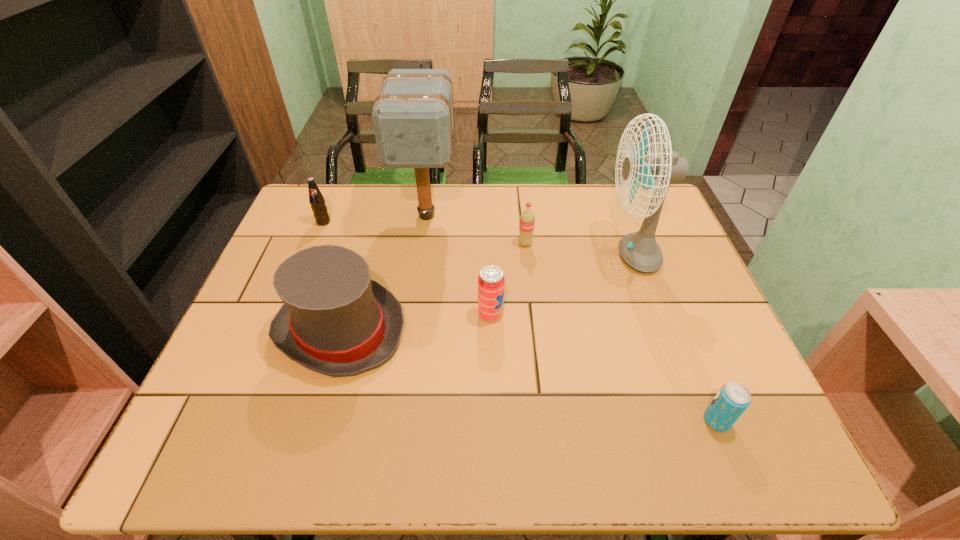
I want to click on mallet, so click(x=413, y=117).

What are the coordinates of `fan` in the screenshot? It's located at coord(639,250).

Identify the location of the fifth shortest object. (335, 320).

Locate an element on the screen. This screenshot has height=540, width=960. the leftmost soda can is located at coordinates (316, 199).

Identify the location of the third object from right to left. The image size is (960, 540). (527, 218).

What are the coordinates of `the second soda can from right to left` in the screenshot? It's located at (527, 218).

Locate an element on the screen. The width and height of the screenshot is (960, 540). the fourth object from right to left is located at coordinates (491, 282).

Locate an element on the screen. This screenshot has width=960, height=540. the second nearest soda can is located at coordinates (491, 282).

In order to click on the nearest soda can in this screenshot , I will do `click(733, 398)`.

Locate an element on the screen. The height and width of the screenshot is (540, 960). the nearest object is located at coordinates (733, 398).